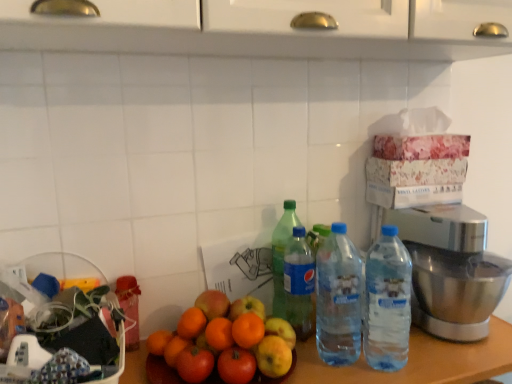
Where is `vacant space behind clear plastic water bottles at center-right, placed as the 4th bottle when sorted from left to right`? This screenshot has width=512, height=384. vacant space behind clear plastic water bottles at center-right, placed as the 4th bottle when sorted from left to right is located at coordinates (381, 340).